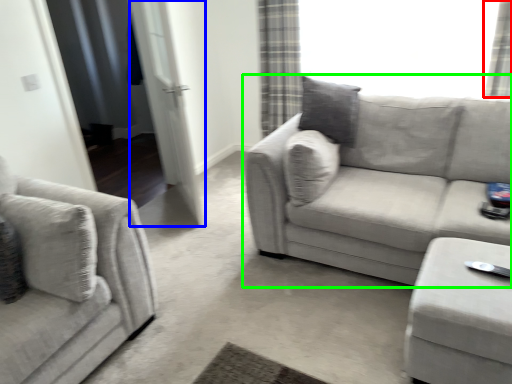
Question: Which object is positioned farthest from curtain (highlighted by a red box)? Select from screen door (highlighted by a blue box) and studio couch (highlighted by a green box).

Choices:
 (A) screen door
 (B) studio couch

Answer: (A)